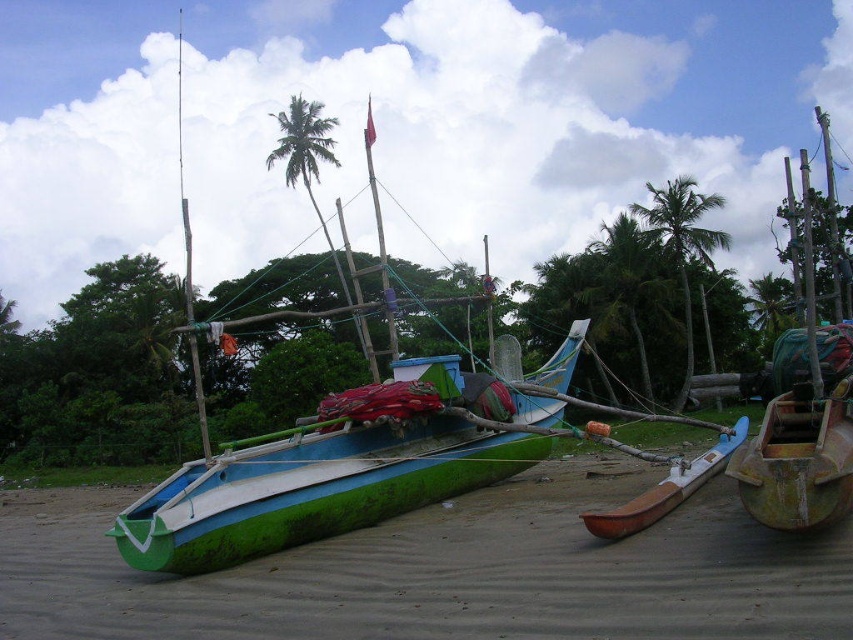
Question: Is green matte boat at center smaller than green leafy palm tree at center?

Choices:
 (A) yes
 (B) no

Answer: (B)

Question: Among these points, which one is nearest to the camera?

Choices:
 (A) [x=260, y=444]
 (B) [x=682, y=385]
 (C) [x=693, y=468]

Answer: (A)

Question: Does green matte boat at center lie in front of brown wood canoe at lower right?

Choices:
 (A) yes
 (B) no

Answer: (B)

Question: Among these points, which one is nearest to the camera?

Choices:
 (A) (583, 625)
 (B) (643, 220)
 (C) (660, 499)
 (D) (590, 292)

Answer: (A)

Question: Is green wood boat at center thinner than brown wood canoe at lower right?

Choices:
 (A) no
 (B) yes

Answer: (A)

Question: Which is nearer to the green matte boat at center?

Choices:
 (A) green leafy palm tree at upper center
 (B) green leafy palm tree at center
 (C) brown wood canoe at lower right
 (D) green wood boat at center

Answer: (D)